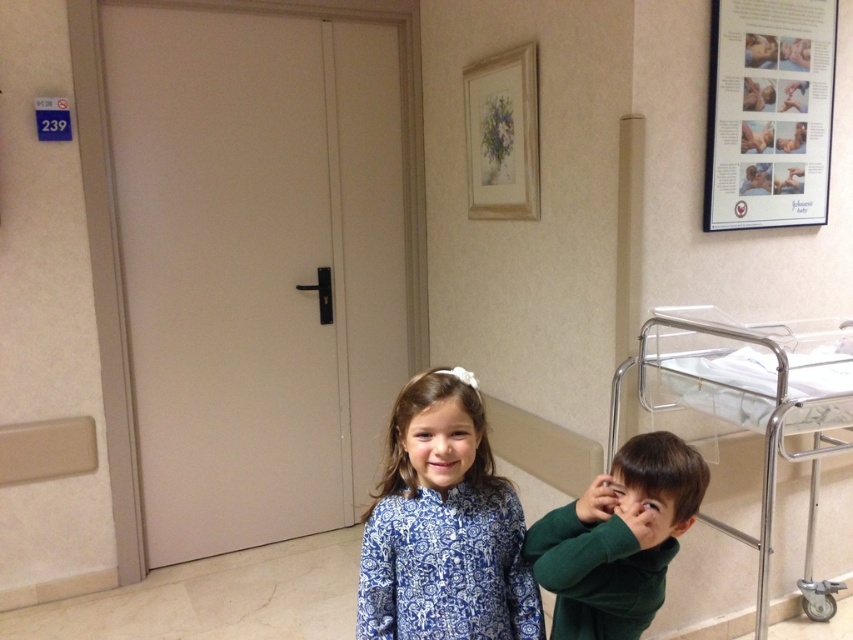
Which is behind, point (416, 582) or point (578, 612)?

Positioned behind is point (578, 612).

Looking at this image, is blue printed dress at center wider than green matte shirt at lower right?

Indeed, blue printed dress at center has a greater width compared to green matte shirt at lower right.

At what (x,y) coordinates should I click in order to perform the action: click on blue printed dress at center. Please return your answer as a coordinate pair (x, y). This screenshot has width=853, height=640. Looking at the image, I should click on (444, 528).

What do you see at coordinates (444, 528) in the screenshot? The image size is (853, 640). I see `blue printed dress at center` at bounding box center [444, 528].

Does blue printed dress at center have a greater width compared to metallic hospital bed at right?

Incorrect, blue printed dress at center's width does not surpass metallic hospital bed at right's.

At what (x,y) coordinates should I click in order to perform the action: click on blue printed dress at center. Please return your answer as a coordinate pair (x, y). Looking at the image, I should click on (444, 528).

Image resolution: width=853 pixels, height=640 pixels. I want to click on blue printed dress at center, so click(x=444, y=528).

Is metallic hospital bed at right above green matte shirt at lower right?

Indeed, metallic hospital bed at right is positioned over green matte shirt at lower right.

Is point (706, 518) behind point (662, 563)?

Yes, point (706, 518) is farther from viewer.

Identify the location of metallic hospital bed at right. (752, 413).